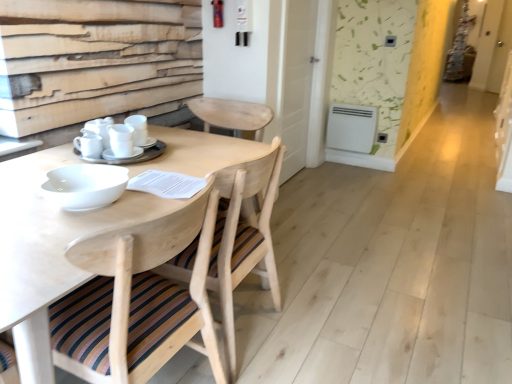
You are a GUI agent. You are given a task and a screenshot of the screen. Output one action in this format:
    pyautogui.click(x=<x>, y=<y>)
    Task: Click on the free space above white plastic radiator at center (from a real-world perspective)
    
    Given the screenshot: What is the action you would take?
    pyautogui.click(x=359, y=103)